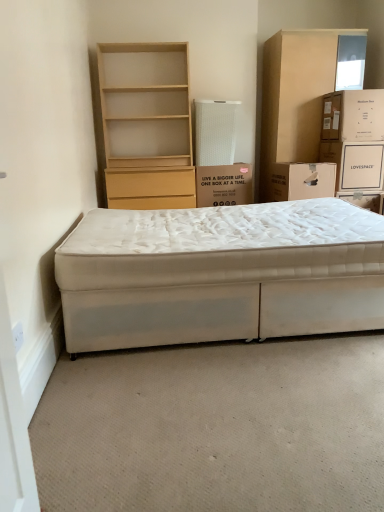
Describe the element at coordinates (302, 181) in the screenshot. This screenshot has width=384, height=512. I see `white cardboard box at right, the second box positioned from the right` at that location.

What is the approximate height of white fabric bed at lower center?

white fabric bed at lower center is 21.80 inches in height.

This screenshot has width=384, height=512. Identify the location of medium brown cardboard box at upper right, arranged as the 3th box when viewed from the left. (353, 115).

The width and height of the screenshot is (384, 512). Find the location of `cabinetry to the right of white cardboard box at center, which is the first box in left-to-right order`. cabinetry to the right of white cardboard box at center, which is the first box in left-to-right order is located at coordinates (295, 96).

From the image's perspective, which is above, beige cardboard cabinet at upper right or white cardboard box at center, which is the first box in left-to-right order?

beige cardboard cabinet at upper right appears higher in the image.

Based on the photo, between beige cardboard cabinet at upper right and white cardboard box at center, the third box when ordered from right to left, which one appears on the left side from the viewer's perspective?

white cardboard box at center, the third box when ordered from right to left.

Between white cardboard box at right, arranged as the second box when viewed from the left, and white fabric bed at lower center, which one appears on the right side from the viewer's perspective?

From the viewer's perspective, white cardboard box at right, arranged as the second box when viewed from the left, appears more on the right side.

Where is `the 1st box above the white fabric bed at lower center (from the image's perspective)`? The width and height of the screenshot is (384, 512). the 1st box above the white fabric bed at lower center (from the image's perspective) is located at coordinates (302, 181).

Could you tell me if white cardboard box at right, arranged as the second box when viewed from the left, is turned towards white fabric bed at lower center?

No, white cardboard box at right, arranged as the second box when viewed from the left, is not aimed at white fabric bed at lower center.

Consider the image. Between medium brown cardboard box at upper right, arranged as the 3th box when viewed from the left, and white fabric bed at lower center, which one has smaller size?

With smaller size is medium brown cardboard box at upper right, arranged as the 3th box when viewed from the left.

Is medium brown cardboard box at upper right, placed as the 1th box when sorted from right to left, oriented away from white fabric bed at lower center?

That's not correct — medium brown cardboard box at upper right, placed as the 1th box when sorted from right to left, is not looking away from white fabric bed at lower center.

Considering the relative positions of medium brown cardboard box at upper right, placed as the 1th box when sorted from right to left, and white fabric bed at lower center in the image provided, is medium brown cardboard box at upper right, placed as the 1th box when sorted from right to left, in front of white fabric bed at lower center?

No, the depth of medium brown cardboard box at upper right, placed as the 1th box when sorted from right to left, is greater than that of white fabric bed at lower center.

Between point (348, 106) and point (277, 101), which one is positioned behind?

The point (277, 101) is more distant.

From a real-world perspective, relative to beige cardboard cabinet at upper right, is medium brown cardboard box at upper right, arranged as the 3th box when viewed from the left, vertically above or below?

medium brown cardboard box at upper right, arranged as the 3th box when viewed from the left, is above beige cardboard cabinet at upper right.

Which is behind, medium brown cardboard box at upper right, placed as the 1th box when sorted from right to left, or beige cardboard cabinet at upper right?

beige cardboard cabinet at upper right is behind.

Is white cardboard box at right, the second box positioned from the right, oriented away from white cardboard box at center, the third box when ordered from right to left?

white cardboard box at right, the second box positioned from the right, is not turned away from white cardboard box at center, the third box when ordered from right to left.

Considering the sizes of objects white cardboard box at right, arranged as the second box when viewed from the left, and white cardboard box at center, the third box when ordered from right to left, in the image provided, who is smaller, white cardboard box at right, arranged as the second box when viewed from the left, or white cardboard box at center, the third box when ordered from right to left,?

Smaller between the two is white cardboard box at right, arranged as the second box when viewed from the left.

Considering the points (315, 163) and (206, 206), which point is behind, point (315, 163) or point (206, 206)?

Point (315, 163)

From the image's perspective, which is below, white fabric bed at lower center or medium brown cardboard box at upper right, arranged as the 3th box when viewed from the left?

white fabric bed at lower center appears lower in the image.

Does point (284, 261) come behind point (338, 114)?

No.

Between white fabric bed at lower center and medium brown cardboard box at upper right, placed as the 1th box when sorted from right to left, which one is positioned in front?

Positioned in front is white fabric bed at lower center.

Between white fabric bed at lower center and medium brown cardboard box at upper right, placed as the 1th box when sorted from right to left, which one has more height?

white fabric bed at lower center is taller.

Which is in front, point (112, 289) or point (244, 175)?

The point (112, 289) is closer to the camera.

Is white fabric bed at lower center aimed at white cardboard box at center, which is the first box in left-to-right order?

No, white fabric bed at lower center is not aimed at white cardboard box at center, which is the first box in left-to-right order.

How many degrees apart are the facing directions of white fabric bed at lower center and white cardboard box at center, which is the first box in left-to-right order?

white fabric bed at lower center and white cardboard box at center, which is the first box in left-to-right order, are facing 89.6 degrees away from each other.

Between white fabric bed at lower center and white cardboard box at center, the third box when ordered from right to left, which one has smaller size?

white cardboard box at center, the third box when ordered from right to left.

From the beige cardboard cabinet at upper right, count the 2nd box to the left and point to it. Please provide its 2D coordinates.

[(224, 185)]

Identify the location of bed below the white cardboard box at right, the second box positioned from the right (from the image's perspective). This screenshot has width=384, height=512. (213, 272).

Based on their spatial positions, is light wood/finely finished bookshelf at upper left or white cardboard box at upper right further from white cardboard box at center, the third box when ordered from right to left?

Among the two, white cardboard box at upper right is located further to white cardboard box at center, the third box when ordered from right to left.

From the image, which object appears to be nearer to white cardboard box at right, arranged as the second box when viewed from the left, beige cardboard cabinet at upper right or white cardboard box at center, the third box when ordered from right to left?

white cardboard box at center, the third box when ordered from right to left, lies closer to white cardboard box at right, arranged as the second box when viewed from the left, than the other object.

Looking at the image, which one is located further to white cardboard box at center, which is the first box in left-to-right order, medium brown cardboard box at upper right, arranged as the 3th box when viewed from the left, or light wood/finely finished bookshelf at upper left?

medium brown cardboard box at upper right, arranged as the 3th box when viewed from the left.

Looking at the image, which one is located closer to beige cardboard cabinet at upper right, white cardboard box at center, the third box when ordered from right to left, or light wood/finely finished bookshelf at upper left?

Based on the image, white cardboard box at center, the third box when ordered from right to left, appears to be nearer to beige cardboard cabinet at upper right.

Looking at this image, when comparing their distances from beige cardboard cabinet at upper right, does medium brown cardboard box at upper right, placed as the 1th box when sorted from right to left, or light wood/finely finished bookshelf at upper left seem further?

light wood/finely finished bookshelf at upper left lies further to beige cardboard cabinet at upper right than the other object.

When comparing their distances from white fabric bed at lower center, does light wood/finely finished bookshelf at upper left or white cardboard box at upper right seem closer?

white cardboard box at upper right lies closer to white fabric bed at lower center than the other object.

Looking at the image, which one is located closer to white cardboard box at center, which is the first box in left-to-right order, beige cardboard cabinet at upper right or white cardboard box at upper right?

Among the two, beige cardboard cabinet at upper right is located nearer to white cardboard box at center, which is the first box in left-to-right order.

Looking at the image, which one is located further to white fabric bed at lower center, beige cardboard cabinet at upper right or light wood/finely finished bookshelf at upper left?

beige cardboard cabinet at upper right is positioned further to the anchor white fabric bed at lower center.

The width and height of the screenshot is (384, 512). I want to click on box between white cardboard box at center, which is the first box in left-to-right order, and beige cardboard cabinet at upper right, so click(x=302, y=181).

Identify the location of box between light wood/finely finished bookshelf at upper left and white cardboard box at right, the second box positioned from the right, from left to right. (224, 185).

Where is `cupboard positioned between white fabric bed at lower center and beige cardboard cabinet at upper right from near to far`? cupboard positioned between white fabric bed at lower center and beige cardboard cabinet at upper right from near to far is located at coordinates (146, 125).

Where is `storage box located between white fabric bed at lower center and beige cardboard cabinet at upper right in the depth direction`? storage box located between white fabric bed at lower center and beige cardboard cabinet at upper right in the depth direction is located at coordinates (356, 164).